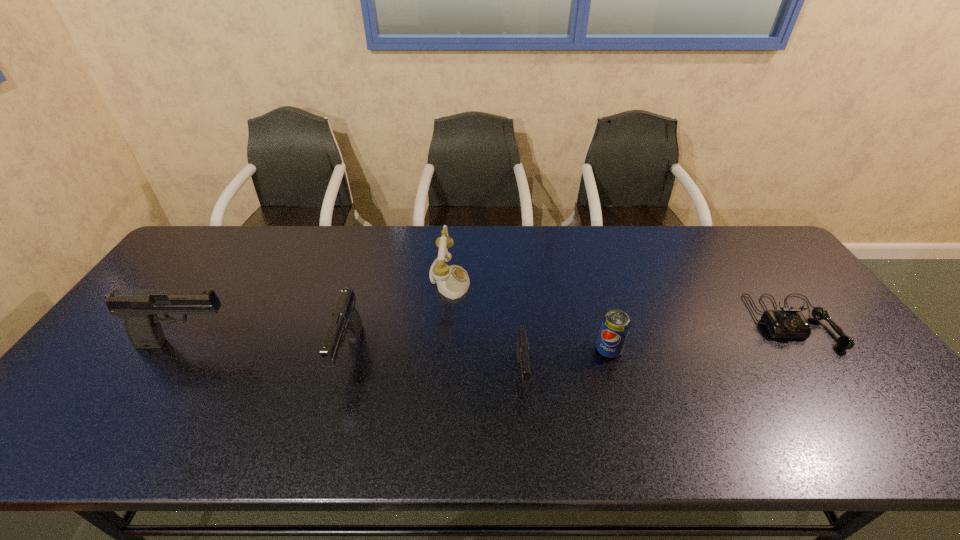
The height and width of the screenshot is (540, 960). What are the coordinates of `vacant space that's between the leftmost object and the second pistol from right to left` in the screenshot? It's located at (269, 350).

You are a GUI agent. You are given a task and a screenshot of the screen. Output one action in this format:
    pyautogui.click(x=<x>, y=<y>)
    Task: Click on the empty space that is in between the taller telephone and the leftmost pistol
    The image size is (960, 540).
    Given the screenshot: What is the action you would take?
    pyautogui.click(x=319, y=312)

Find the location of a particular element. The image size is (960, 540). free space between the leftmost object and the fifth object from left to right is located at coordinates (398, 346).

Locate an element on the screen. empty location between the left telephone and the second tallest pistol is located at coordinates (399, 320).

Find the location of a particular element. vacant space that is in between the left telephone and the leftmost pistol is located at coordinates (319, 312).

The height and width of the screenshot is (540, 960). I want to click on free space between the rightmost object and the second tallest pistol, so click(571, 340).

Locate an element on the screen. The image size is (960, 540). empty space between the shortest pistol and the second pistol from right to left is located at coordinates (436, 366).

What are the coordinates of `free space between the second pistol from right to left and the left telephone` in the screenshot? It's located at (399, 320).

This screenshot has width=960, height=540. In order to click on free space between the second object from right to left and the shortest pistol in this screenshot , I will do `click(565, 362)`.

Image resolution: width=960 pixels, height=540 pixels. Find the location of `unoccupied area between the taller telephone and the fourth object from left to right`. unoccupied area between the taller telephone and the fourth object from left to right is located at coordinates (486, 328).